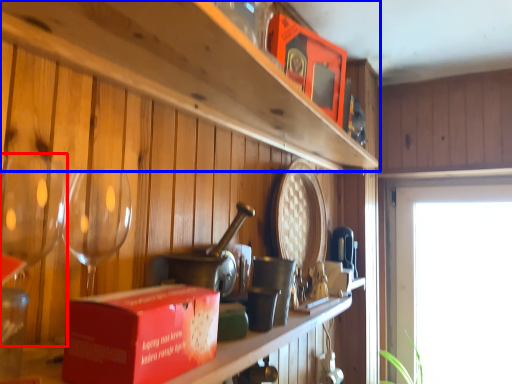
Question: Which object appears closest to the camera in this image, wine glass (highlighted by a red box) or shelf (highlighted by a blue box)?

Choices:
 (A) wine glass
 (B) shelf

Answer: (B)